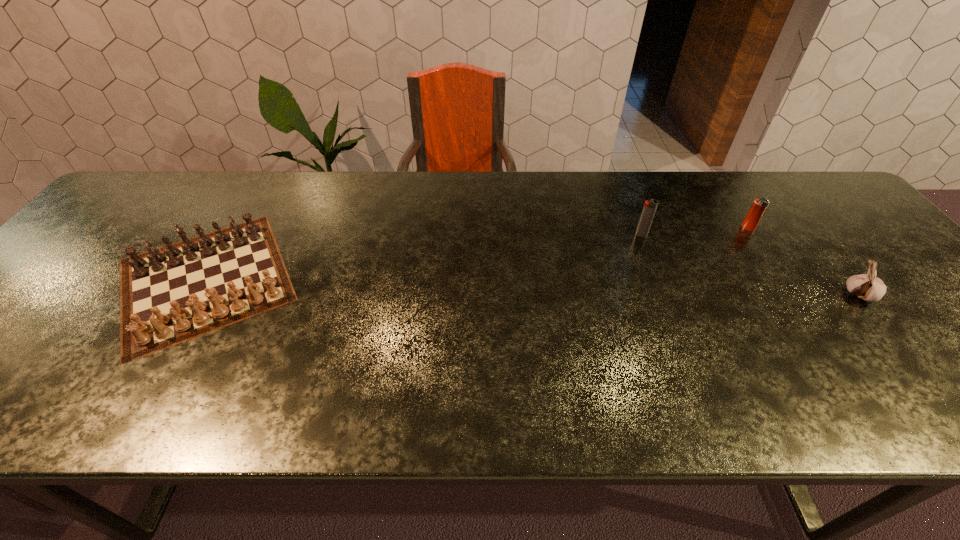
What are the coordinates of `the left igniter` in the screenshot? It's located at (649, 209).

At what (x,y) coordinates should I click in order to perform the action: click on the nearer igniter. Please return your answer as a coordinate pair (x, y). Looking at the image, I should click on (649, 209).

Where is `the right igniter`? The image size is (960, 540). the right igniter is located at coordinates coord(759,206).

Find the location of a particular element. The image size is (960, 540). the second object from right to left is located at coordinates (759, 206).

This screenshot has width=960, height=540. In order to click on garlic in this screenshot , I will do `click(868, 287)`.

In order to click on the leftmost object in this screenshot , I will do `click(188, 285)`.

Find the location of a particular element. vacant space located on the front of the left igniter is located at coordinates (667, 302).

The width and height of the screenshot is (960, 540). Identify the location of free space located on the left of the right igniter. (618, 228).

In order to click on free region located 0.170m on the front of the rightmost object in this screenshot , I will do `click(922, 373)`.

The width and height of the screenshot is (960, 540). I want to click on blank space located on the front of the leftmost object, so click(x=129, y=406).